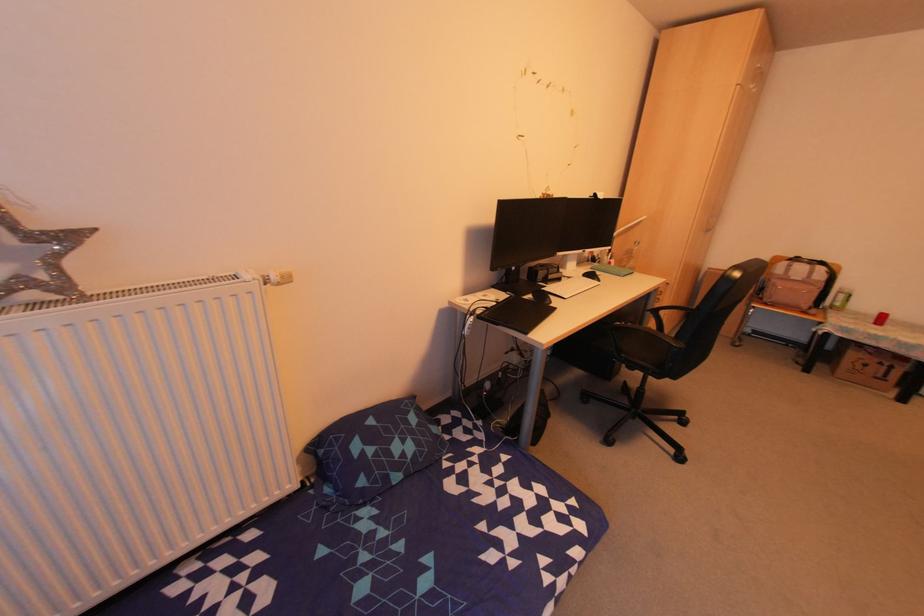
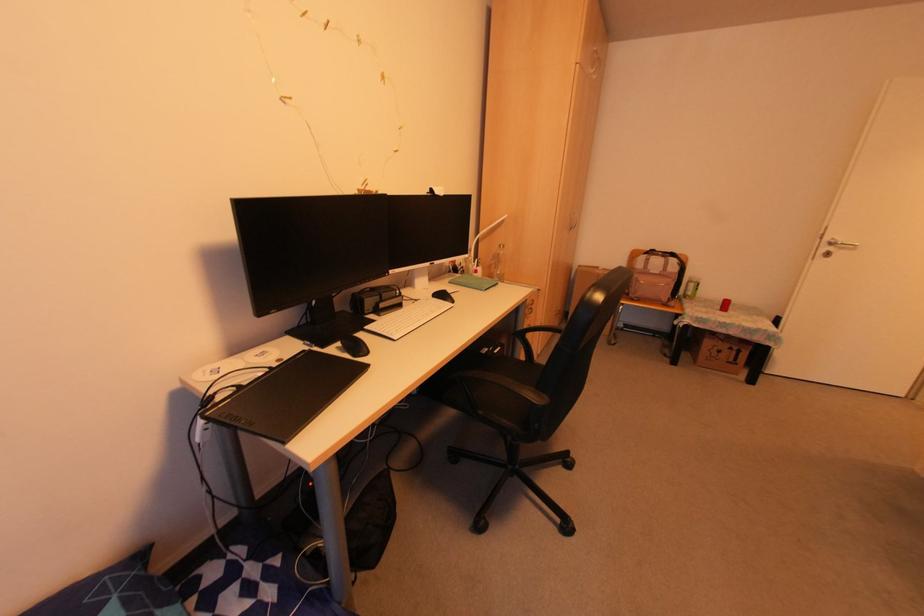
Question: I am providing you with two images of the same scene from different viewpoints. Which of the following objects are not visible in image2?

Choices:
 (A) green spray can
 (B) chair armrest
 (C) silver door handle
 (D) none of these

Answer: (D)